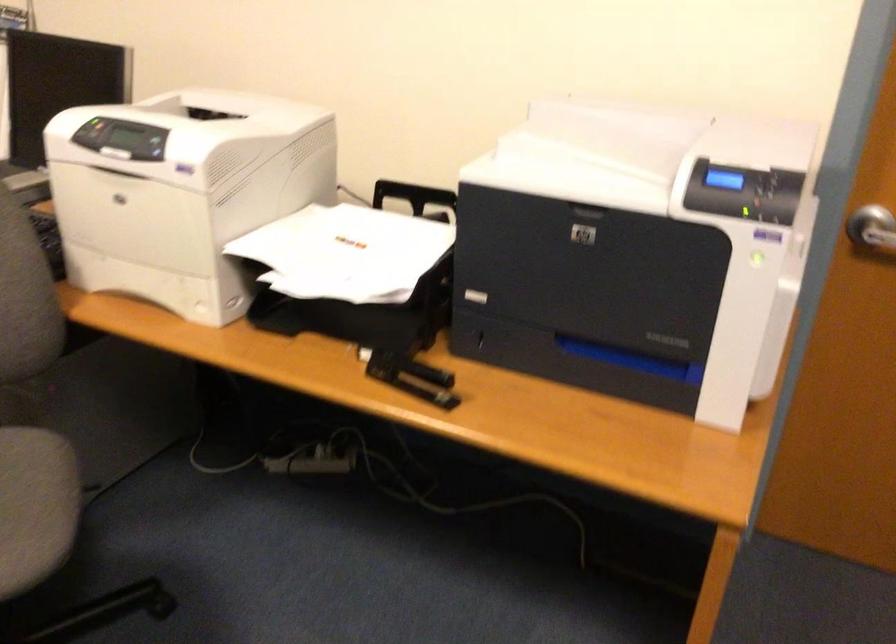
The height and width of the screenshot is (644, 896). In order to click on silver door handle in this screenshot , I will do `click(872, 230)`.